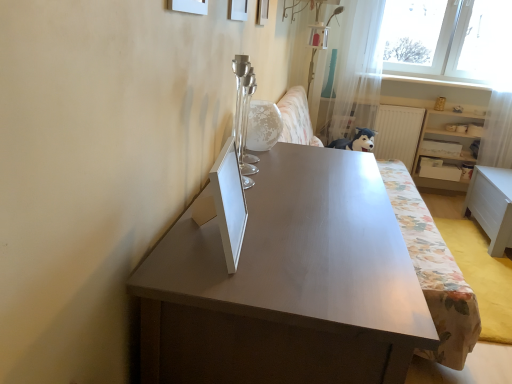
Question: Can you confirm if floral fabric couch at center is wider than white matte picture frame at upper center, which is the second picture frame from front to back?

Choices:
 (A) no
 (B) yes

Answer: (B)

Question: Could white matte picture frame at upper center, which is counted as the second picture frame, starting from the left, be considered to be inside floral fabric couch at center?

Choices:
 (A) no
 (B) yes

Answer: (A)

Question: Is floral fabric couch at center placed right next to white matte picture frame at upper center, which is the 2th picture frame from back to front?

Choices:
 (A) no
 (B) yes

Answer: (A)

Question: From the image's perspective, would you say floral fabric couch at center is positioned over white matte picture frame at upper center, the second picture frame positioned from the right?

Choices:
 (A) no
 (B) yes

Answer: (A)

Question: From a real-world perspective, is floral fabric couch at center positioned over white matte picture frame at upper center, which is counted as the second picture frame, starting from the left, based on gravity?

Choices:
 (A) yes
 (B) no

Answer: (B)

Question: From the image's perspective, is white matte picture frame at upper center, which is the second picture frame from front to back, above or below white wooden shelf at right?

Choices:
 (A) below
 (B) above

Answer: (B)

Question: Does point (230, 9) appear closer or farther from the camera than point (418, 139)?

Choices:
 (A) closer
 (B) farther

Answer: (A)

Question: In the image, is white matte picture frame at upper center, which is counted as the second picture frame, starting from the left, on the left side or the right side of white wooden shelf at right?

Choices:
 (A) right
 (B) left

Answer: (B)

Question: Considering the positions of white matte picture frame at upper center, which is counted as the second picture frame, starting from the left, and white wooden shelf at right in the image, is white matte picture frame at upper center, which is counted as the second picture frame, starting from the left, wider or thinner than white wooden shelf at right?

Choices:
 (A) wide
 (B) thin

Answer: (B)

Question: Visually, is matte gray table at center, which is the second table in right-to-left order, positioned to the left or to the right of white matte picture frame at upper center, the 3th picture frame when ordered from left to right?

Choices:
 (A) left
 (B) right

Answer: (B)

Question: From the image's perspective, is matte gray table at center, which is the first table from left to right, above or below white matte picture frame at upper center, the first picture frame from the back?

Choices:
 (A) below
 (B) above

Answer: (A)

Question: Considering the positions of point (423, 339) and point (258, 0), is point (423, 339) closer or farther from the camera than point (258, 0)?

Choices:
 (A) closer
 (B) farther

Answer: (A)

Question: Based on their sizes in the image, would you say matte gray table at center, which is the second table in right-to-left order, is bigger or smaller than white matte picture frame at upper center, the first picture frame from the back?

Choices:
 (A) big
 (B) small

Answer: (A)

Question: Is floral fabric couch at center wider or thinner than white glossy table at lower right, positioned as the 1th table in back-to-front order?

Choices:
 (A) wide
 (B) thin

Answer: (A)

Question: From a real-world perspective, is floral fabric couch at center positioned above or below white glossy table at lower right, acting as the second table starting from the left?

Choices:
 (A) above
 (B) below

Answer: (A)